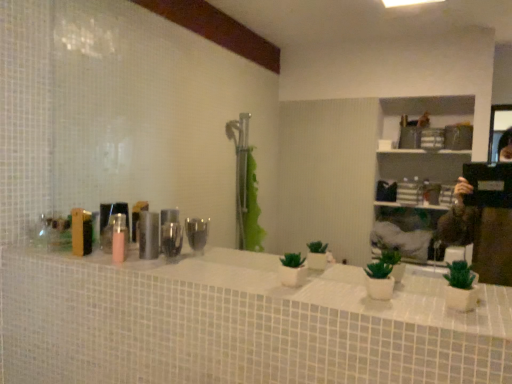
Question: In which direction should I rotate to look at metallic cylindrical container at center, which is the first toiletry in right-to-left order?

Choices:
 (A) right
 (B) left

Answer: (B)

Question: From the image's perspective, is white glossy counter top at center located beneath metallic cylindrical container at center, the 2th toiletry positioned from the left?

Choices:
 (A) no
 (B) yes

Answer: (B)

Question: Can you confirm if white glossy counter top at center is smaller than metallic cylindrical container at center, which is the first toiletry in right-to-left order?

Choices:
 (A) yes
 (B) no

Answer: (B)

Question: Can you confirm if white glossy counter top at center is bigger than metallic cylindrical container at center, which is the first toiletry in right-to-left order?

Choices:
 (A) yes
 (B) no

Answer: (A)

Question: Can you confirm if white glossy counter top at center is taller than metallic cylindrical container at center, which is the first toiletry in right-to-left order?

Choices:
 (A) no
 (B) yes

Answer: (A)

Question: Is white glossy counter top at center positioned beyond the bounds of metallic cylindrical container at center, the 2th toiletry positioned from the left?

Choices:
 (A) yes
 (B) no

Answer: (A)

Question: Does white glossy counter top at center have a lesser height compared to metallic cylindrical container at center, the 2th toiletry positioned from the left?

Choices:
 (A) yes
 (B) no

Answer: (A)

Question: Does metallic cylindrical container at center, which is the first toiletry in right-to-left order, appear on the left side of wooden box at left, the first toiletry when ordered from left to right?

Choices:
 (A) no
 (B) yes

Answer: (A)

Question: Is wooden box at left, arranged as the second toiletry when viewed from the right, located within metallic cylindrical container at center, the 2th toiletry positioned from the left?

Choices:
 (A) yes
 (B) no

Answer: (B)

Question: Can you see metallic cylindrical container at center, the 2th toiletry positioned from the left, touching wooden box at left, arranged as the second toiletry when viewed from the right?

Choices:
 (A) yes
 (B) no

Answer: (B)

Question: Is metallic cylindrical container at center, the 2th toiletry positioned from the left, not within wooden box at left, the first toiletry when ordered from left to right?

Choices:
 (A) no
 (B) yes

Answer: (B)

Question: Is metallic cylindrical container at center, the 2th toiletry positioned from the left, at the right side of wooden box at left, the first toiletry when ordered from left to right?

Choices:
 (A) yes
 (B) no

Answer: (A)

Question: Considering the relative sizes of metallic cylindrical container at center, which is the first toiletry in right-to-left order, and wooden box at left, arranged as the second toiletry when viewed from the right, in the image provided, is metallic cylindrical container at center, which is the first toiletry in right-to-left order, shorter than wooden box at left, arranged as the second toiletry when viewed from the right,?

Choices:
 (A) no
 (B) yes

Answer: (B)

Question: Does wooden box at left, the first toiletry when ordered from left to right, appear on the right side of white glossy counter top at center?

Choices:
 (A) no
 (B) yes

Answer: (A)